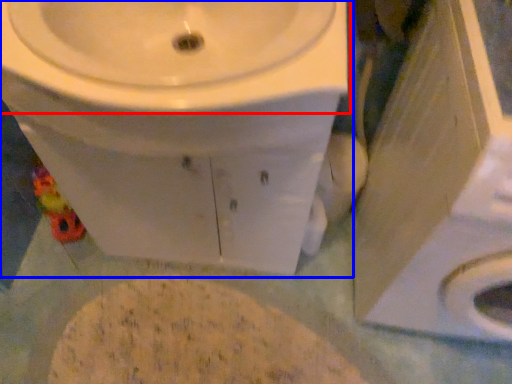
Question: Which object is further to the camera taking this photo, sink (highlighted by a red box) or toilet (highlighted by a blue box)?

Choices:
 (A) sink
 (B) toilet

Answer: (B)